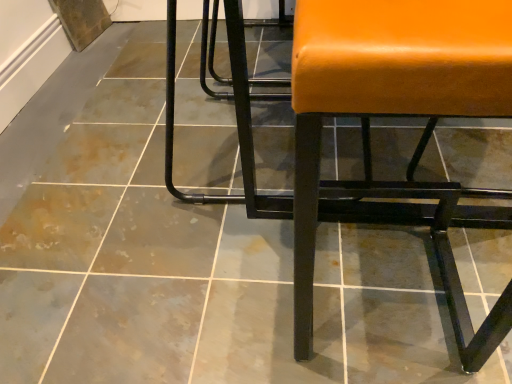
The width and height of the screenshot is (512, 384). Describe the element at coordinates (396, 115) in the screenshot. I see `orange leather chair at right` at that location.

You are a GUI agent. You are given a task and a screenshot of the screen. Output one action in this format:
    pyautogui.click(x=<x>, y=<y>)
    Task: Click on the orange leather chair at right
    
    Given the screenshot: What is the action you would take?
    pyautogui.click(x=396, y=115)

You are a GUI agent. You are given a task and a screenshot of the screen. Output one action in this format:
    pyautogui.click(x=<x>, y=<y>)
    Task: Click on the orange leather chair at right
    Image resolution: width=512 pixels, height=384 pixels.
    Given the screenshot: What is the action you would take?
    click(396, 115)